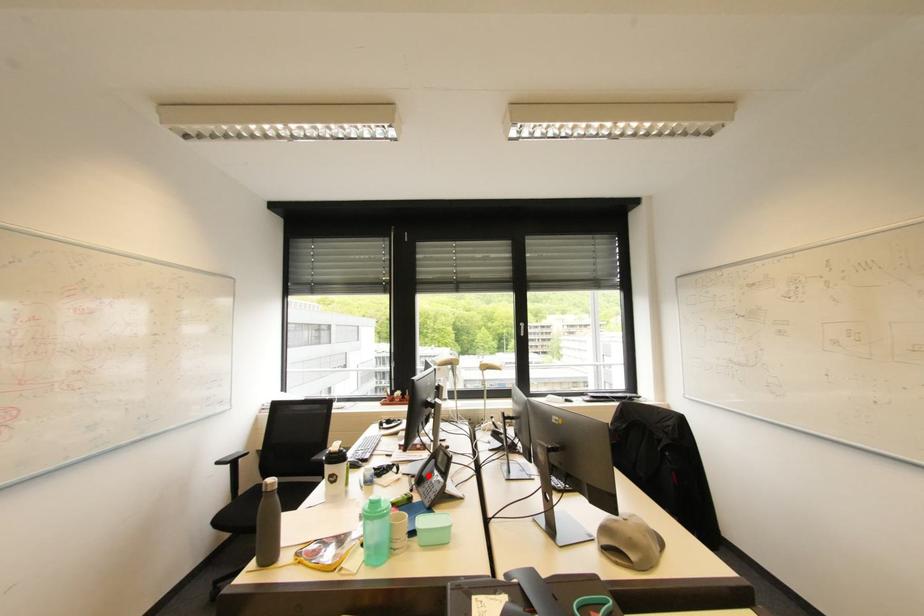
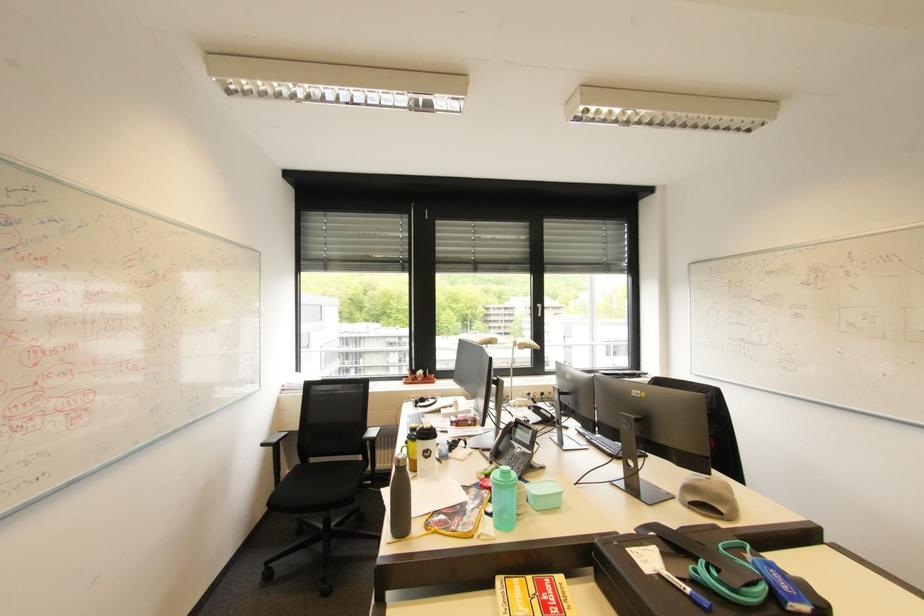
Locate, in the second image, the point that corresponds to the highlighted location in the first image.

(505, 448)